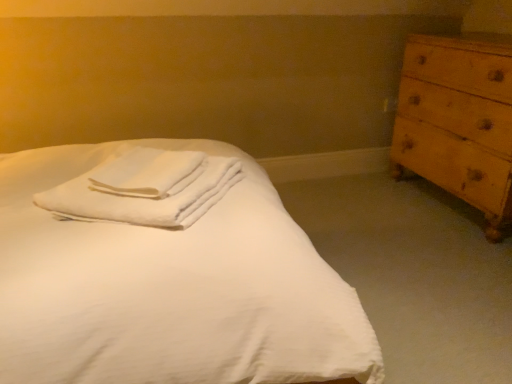
The width and height of the screenshot is (512, 384). Describe the element at coordinates (166, 272) in the screenshot. I see `white smooth bed at center` at that location.

In order to face wooden chest of drawers at right, should I rotate leftwards or rightwards?

Turn right approximately 26.963 degrees to face it.

The height and width of the screenshot is (384, 512). Identify the location of white smooth bed at center. (166, 272).

Considering the points (298, 298) and (180, 203), which point is behind, point (298, 298) or point (180, 203)?

The point (180, 203) is farther.

Is white smooth bed at center to the right of white cotton towels at center from the viewer's perspective?

No, white smooth bed at center is not to the right of white cotton towels at center.

Are white smooth bed at center and white cotton towels at center far apart?

No.

Between white smooth bed at center and white cotton towels at center, which one is positioned in front?

Positioned in front is white smooth bed at center.

Does point (163, 194) appear closer or farther from the camera than point (224, 174)?

Point (163, 194).

From the picture: Between white soft towel at center and white cotton towels at center, which one has more height?

With more height is white cotton towels at center.

You are a GUI agent. You are given a task and a screenshot of the screen. Output one action in this format:
    pyautogui.click(x=<x>, y=<y>)
    Task: Click on the material lying below the white soft towel at center (from the image's perspective)
    
    Given the screenshot: What is the action you would take?
    pyautogui.click(x=145, y=188)

Looking at this image, is white soft towel at center positioned far away from white cotton towels at center?

Actually, white soft towel at center and white cotton towels at center are a little close together.

Considering the relative sizes of wooden chest of drawers at right and white smooth bed at center in the image provided, is wooden chest of drawers at right wider than white smooth bed at center?

In fact, wooden chest of drawers at right might be narrower than white smooth bed at center.

Could you tell me if wooden chest of drawers at right is facing white smooth bed at center?

Yes.

Does wooden chest of drawers at right have a lesser height compared to white smooth bed at center?

No, wooden chest of drawers at right is not shorter than white smooth bed at center.

From the image's perspective, is wooden chest of drawers at right over white smooth bed at center?

Indeed, from the image's perspective, wooden chest of drawers at right is shown above white smooth bed at center.

Is point (148, 158) less distant than point (485, 42)?

Yes.

Is white soft towel at center facing away from wooden chest of drawers at right?

No, white soft towel at center is not facing the opposite direction of wooden chest of drawers at right.

Looking at this image, which object is closer to the camera taking this photo, white soft towel at center or wooden chest of drawers at right?

white soft towel at center is in front.

Considering the relative sizes of white soft towel at center and wooden chest of drawers at right in the image provided, is white soft towel at center taller than wooden chest of drawers at right?

In fact, white soft towel at center may be shorter than wooden chest of drawers at right.

In the scene shown: In the image, is white cotton towels at center positioned in front of or behind white soft towel at center?

In the image, white cotton towels at center appears in front of white soft towel at center.

Is white cotton towels at center wider than white soft towel at center?

Yes.

Can you tell me how much white cotton towels at center and white soft towel at center differ in facing direction?

2.79 degrees.

Looking at this image, from a real-world perspective, is white smooth bed at center positioned over white soft towel at center based on gravity?

Actually, white smooth bed at center is physically below white soft towel at center in the real world.

Is white smooth bed at center facing away from white soft towel at center?

white smooth bed at center is not turned away from white soft towel at center.

Considering the relative sizes of white smooth bed at center and white soft towel at center in the image provided, is white smooth bed at center shorter than white soft towel at center?

No, white smooth bed at center is not shorter than white soft towel at center.

Identify the location of chest of drawers to the right of white smooth bed at center. (458, 121).

How different are the orientations of white smooth bed at center and wooden chest of drawers at right in degrees?

180 degrees separate the facing orientations of white smooth bed at center and wooden chest of drawers at right.

Is white smooth bed at center far away from wooden chest of drawers at right?

That's right, there is a large distance between white smooth bed at center and wooden chest of drawers at right.

Does white smooth bed at center have a larger size compared to wooden chest of drawers at right?

Yes, white smooth bed at center is bigger than wooden chest of drawers at right.

Where is `bed that appears below the white cotton towels at center (from a real-world perspective)`? The width and height of the screenshot is (512, 384). bed that appears below the white cotton towels at center (from a real-world perspective) is located at coordinates (166, 272).

Find the location of a particular element. bath towel that is above the white cotton towels at center (from the image's perspective) is located at coordinates (147, 173).

In the scene shown: Based on their spatial positions, is white smooth bed at center or white cotton towels at center closer to white soft towel at center?

Among the two, white cotton towels at center is located nearer to white soft towel at center.

Looking at the image, which one is located closer to white cotton towels at center, wooden chest of drawers at right or white smooth bed at center?

The object closer to white cotton towels at center is white smooth bed at center.

When comparing their distances from white soft towel at center, does white cotton towels at center or wooden chest of drawers at right seem closer?

white cotton towels at center lies closer to white soft towel at center than the other object.

Based on their spatial positions, is white smooth bed at center or wooden chest of drawers at right closer to white cotton towels at center?

The object closer to white cotton towels at center is white smooth bed at center.

Based on their spatial positions, is white soft towel at center or white cotton towels at center further from white smooth bed at center?

Among the two, white soft towel at center is located further to white smooth bed at center.

From the image, which object appears to be nearer to wooden chest of drawers at right, white soft towel at center or white smooth bed at center?

white smooth bed at center.

Looking at this image, looking at the image, which one is located closer to white smooth bed at center, wooden chest of drawers at right or white soft towel at center?

white soft towel at center lies closer to white smooth bed at center than the other object.

Based on their spatial positions, is white smooth bed at center or wooden chest of drawers at right further from white soft towel at center?

wooden chest of drawers at right is further to white soft towel at center.

You are a GUI agent. You are given a task and a screenshot of the screen. Output one action in this format:
    pyautogui.click(x=<x>, y=<y>)
    Task: Click on the material located between white smooth bed at center and wooden chest of drawers at right in the left-right direction
    The height and width of the screenshot is (384, 512).
    Given the screenshot: What is the action you would take?
    pyautogui.click(x=145, y=188)

At what (x,y) coordinates should I click in order to perform the action: click on bath towel located between white smooth bed at center and wooden chest of drawers at right in the left-right direction. Please return your answer as a coordinate pair (x, y). Looking at the image, I should click on (147, 173).

You are a GUI agent. You are given a task and a screenshot of the screen. Output one action in this format:
    pyautogui.click(x=<x>, y=<y>)
    Task: Click on the material between white smooth bed at center and white soft towel at center along the z-axis
    This screenshot has height=384, width=512.
    Given the screenshot: What is the action you would take?
    pyautogui.click(x=145, y=188)

The image size is (512, 384). Find the location of `bath towel between white cotton towels at center and wooden chest of drawers at right in the horizontal direction`. bath towel between white cotton towels at center and wooden chest of drawers at right in the horizontal direction is located at coordinates (147, 173).